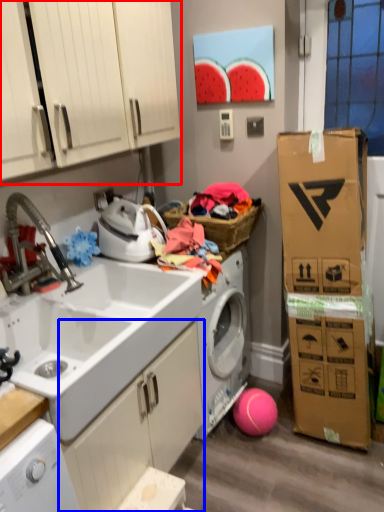
Question: Which object appears closest to the camera in this image, cabinetry (highlighted by a red box) or cabinetry (highlighted by a blue box)?

Choices:
 (A) cabinetry
 (B) cabinetry

Answer: (A)